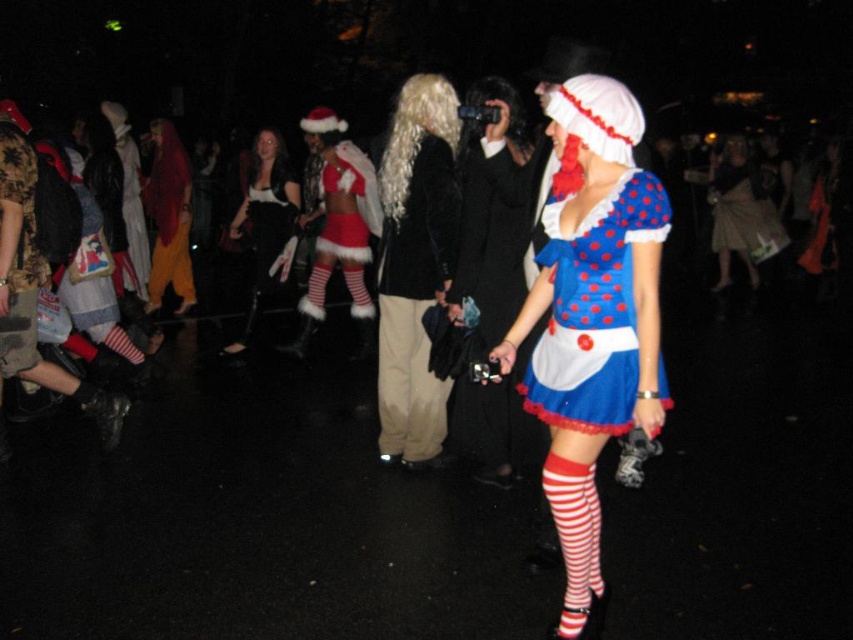
Does matte polka dot dress at center appear over velvet red dress at center?

Actually, matte polka dot dress at center is below velvet red dress at center.

Is point (581, 440) more distant than point (160, 296)?

No, (581, 440) is in front of (160, 296).

Between point (561, 188) and point (175, 227), which one is positioned behind?

Positioned behind is point (175, 227).

Locate an element on the screen. This screenshot has height=640, width=853. matte polka dot dress at center is located at coordinates (592, 317).

Which is behind, point (618, 349) or point (447, 387)?

The point (447, 387) is behind.

Between polka dot fabric dress at center and beige cotton pants at center, which one is positioned higher?

polka dot fabric dress at center is higher up.

Where is `polka dot fabric dress at center`? polka dot fabric dress at center is located at coordinates (593, 310).

Can you confirm if matte black coat at center is bigger than blonde curly wig at center?

Correct, matte black coat at center is larger in size than blonde curly wig at center.

Looking at this image, who is more forward, (x=438, y=214) or (x=451, y=86)?

Point (x=438, y=214) is in front.

Find the location of a particular element. The width and height of the screenshot is (853, 640). matte black coat at center is located at coordinates (415, 264).